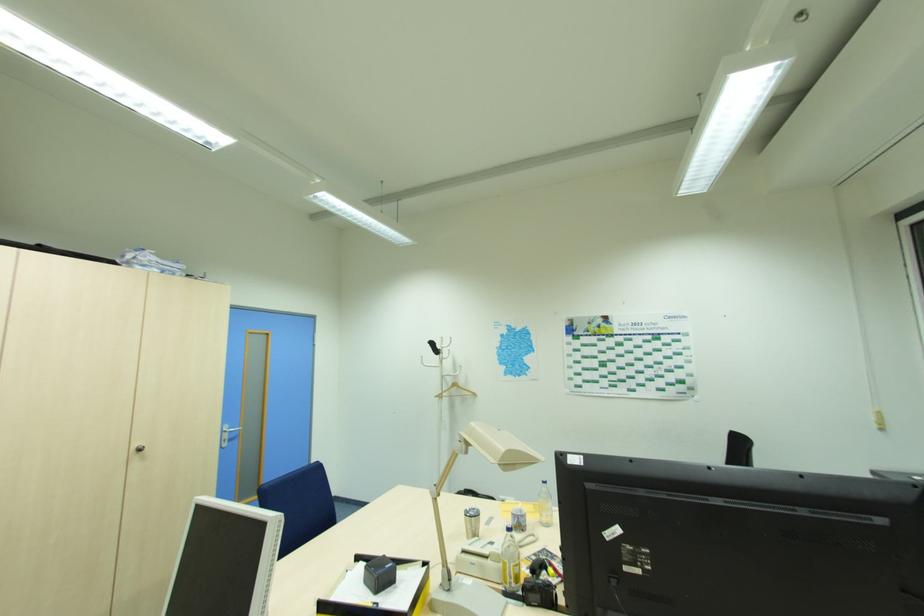
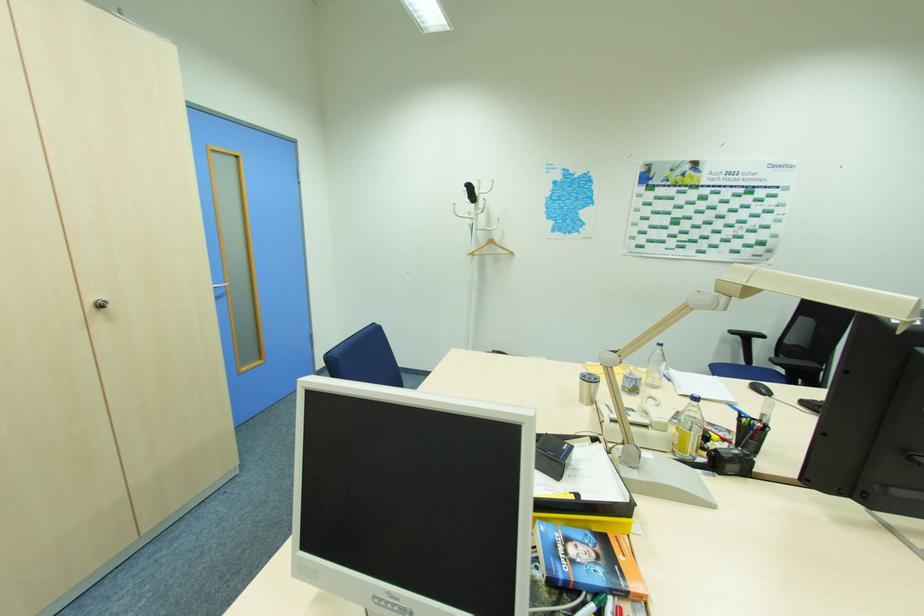
Find the pixel in the second image that matches point (546, 485) in the first image.

(663, 347)